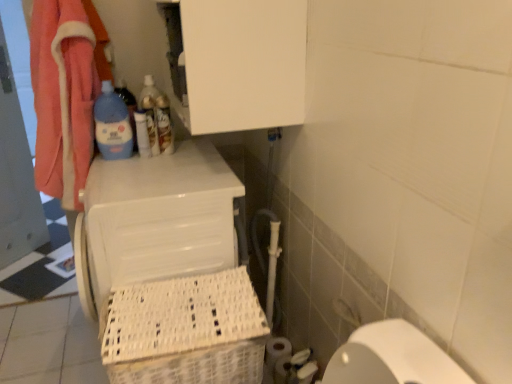
The height and width of the screenshot is (384, 512). In order to click on free location to the right of translucent plastic bottle at upper center, placed as the 2th bottle when sorted from right to left in this screenshot , I will do `click(188, 151)`.